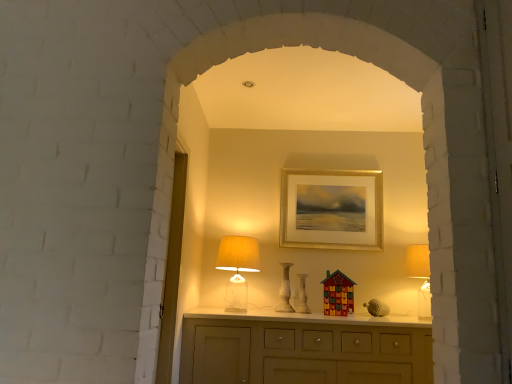
Question: Looking at the image, does white marble vase at center, which is the first vase in left-to-right order, seem bigger or smaller compared to gold/glossy picture frame at upper center?

Choices:
 (A) small
 (B) big

Answer: (A)

Question: From the image's perspective, is white marble vase at center, which is the first vase in left-to-right order, above or below gold/glossy picture frame at upper center?

Choices:
 (A) below
 (B) above

Answer: (A)

Question: Which object is positioned closest to the gold/glossy picture frame at upper center?

Choices:
 (A) white marble vase at center, the 1th vase viewed from the right
 (B) white marble vase at center, which is the first vase in left-to-right order
 (C) translucent glass table lamp at center
 (D) transparent glass door at left

Answer: (B)

Question: Estimate the real-world distances between objects in this image. Which object is closer to the transparent glass door at left?

Choices:
 (A) white marble vase at center, which ranks as the second vase in left-to-right order
 (B) white marble vase at center, arranged as the 2th vase when viewed from the right
 (C) translucent glass table lamp at center
 (D) gold/glossy picture frame at upper center

Answer: (C)